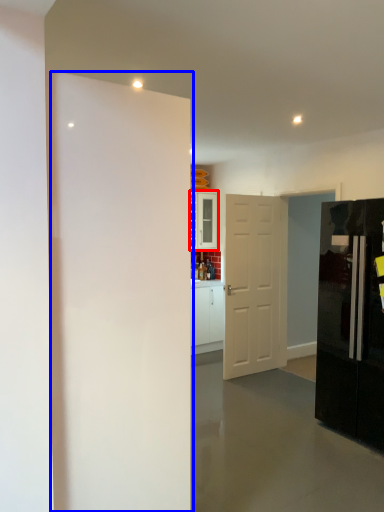
Question: Which of the following is the closest to the observer, cabinetry (highlighted by a red box) or door (highlighted by a blue box)?

Choices:
 (A) cabinetry
 (B) door

Answer: (B)